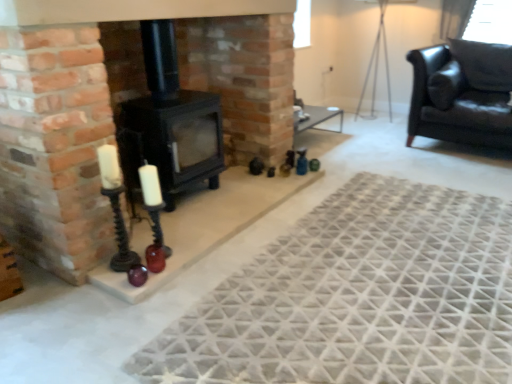
You are a GUI agent. You are given a task and a screenshot of the screen. Output one action in this format:
    pyautogui.click(x=<x>, y=<y>)
    Task: Click on the vacant space in front of black matte wood burning stove at center
    The image size is (512, 384).
    Given the screenshot: What is the action you would take?
    pyautogui.click(x=189, y=227)